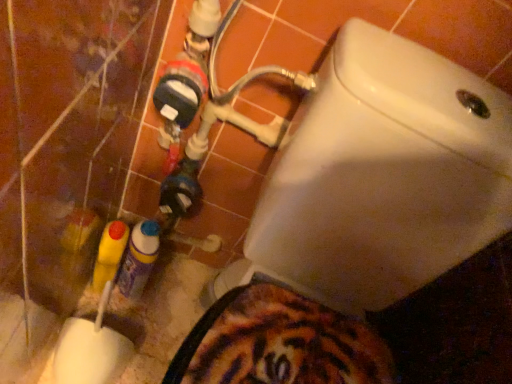
Question: Is translucent plastic spray can at lower left, the second bottle positioned from the left, turned away from yellow plastic bottle at lower left, the second bottle when ordered from right to left?

Choices:
 (A) no
 (B) yes

Answer: (A)

Question: Is translucent plastic spray can at lower left, the second bottle positioned from the left, to the left of yellow plastic bottle at lower left, the 1th bottle in the left-to-right sequence, from the viewer's perspective?

Choices:
 (A) no
 (B) yes

Answer: (A)

Question: Can yellow plastic bottle at lower left, the second bottle when ordered from right to left, be found inside translucent plastic spray can at lower left, acting as the 1th bottle starting from the right?

Choices:
 (A) yes
 (B) no

Answer: (B)

Question: Considering the relative sizes of translucent plastic spray can at lower left, the second bottle positioned from the left, and yellow plastic bottle at lower left, the 1th bottle in the left-to-right sequence, in the image provided, is translucent plastic spray can at lower left, the second bottle positioned from the left, bigger than yellow plastic bottle at lower left, the 1th bottle in the left-to-right sequence,?

Choices:
 (A) no
 (B) yes

Answer: (B)

Question: Does translucent plastic spray can at lower left, the second bottle positioned from the left, have a greater height compared to yellow plastic bottle at lower left, the second bottle when ordered from right to left?

Choices:
 (A) yes
 (B) no

Answer: (A)

Question: Is translucent plastic spray can at lower left, acting as the 1th bottle starting from the right, wider than yellow plastic bottle at lower left, the second bottle when ordered from right to left?

Choices:
 (A) no
 (B) yes

Answer: (B)

Question: From a real-world perspective, is white glossy toilet at upper right positioned under yellow plastic bottle at lower left, the 1th bottle in the left-to-right sequence, based on gravity?

Choices:
 (A) no
 (B) yes

Answer: (A)

Question: Is white glossy toilet at upper right positioned behind yellow plastic bottle at lower left, the second bottle when ordered from right to left?

Choices:
 (A) yes
 (B) no

Answer: (B)

Question: Does white glossy toilet at upper right have a lesser height compared to yellow plastic bottle at lower left, the second bottle when ordered from right to left?

Choices:
 (A) yes
 (B) no

Answer: (B)

Question: From the image's perspective, is white glossy toilet at upper right above yellow plastic bottle at lower left, the 1th bottle in the left-to-right sequence?

Choices:
 (A) no
 (B) yes

Answer: (A)

Question: From a real-world perspective, does white glossy toilet at upper right stand above yellow plastic bottle at lower left, the 1th bottle in the left-to-right sequence?

Choices:
 (A) yes
 (B) no

Answer: (A)

Question: Is white glossy toilet at upper right turned away from yellow plastic bottle at lower left, the 1th bottle in the left-to-right sequence?

Choices:
 (A) yes
 (B) no

Answer: (B)

Question: Is yellow plastic bottle at lower left, the 1th bottle in the left-to-right sequence, positioned before white glossy toilet at upper right?

Choices:
 (A) yes
 (B) no

Answer: (B)